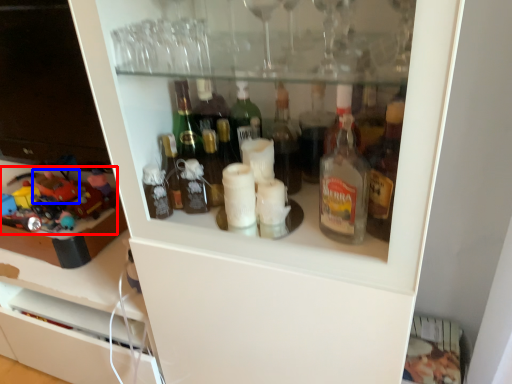
Question: Which object is closer to the camera taking this photo, toy (highlighted by a red box) or toy (highlighted by a blue box)?

Choices:
 (A) toy
 (B) toy

Answer: (A)